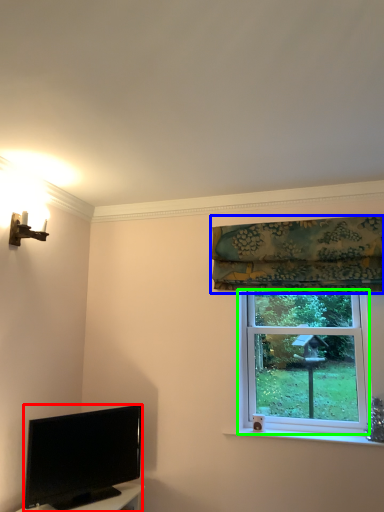
Question: Based on their relative distances, which object is farther from television (highlighted by a red box)? Choose from curtain (highlighted by a blue box) and window screen (highlighted by a green box).

Choices:
 (A) curtain
 (B) window screen

Answer: (A)